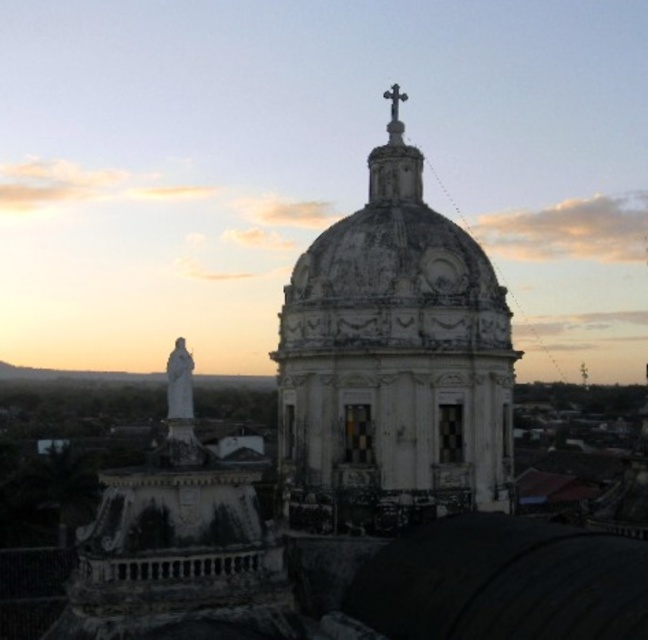
Which of these two, white stone dome at center or polished silver cross at upper center, stands shorter?

With less height is polished silver cross at upper center.

Between white stone dome at center and polished silver cross at upper center, which one is positioned higher?

polished silver cross at upper center is higher up.

Identify the location of white stone dome at center. The height and width of the screenshot is (640, 648). (393, 364).